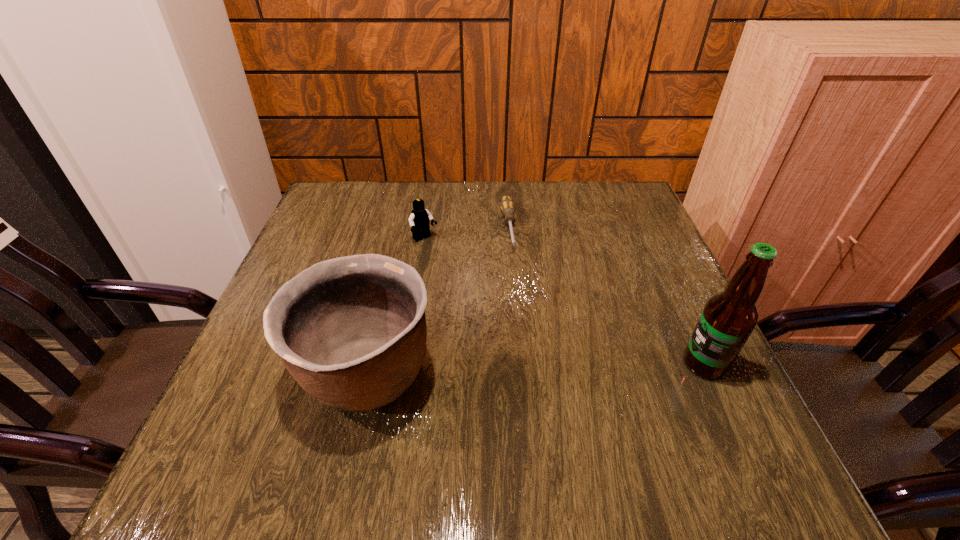
The height and width of the screenshot is (540, 960). Identify the location of free space located at the tip of the shortest object. (525, 345).

Where is `vacant space situated at the tip of the shortest object`? vacant space situated at the tip of the shortest object is located at coordinates (521, 322).

What are the coordinates of `free space located at the tip of the shortest object` in the screenshot? It's located at (527, 356).

In order to click on vacant space located on the front-facing side of the third tallest object in this screenshot , I will do `click(475, 294)`.

At what (x,y) coordinates should I click in order to perform the action: click on vacant space situated 0.210m on the front-facing side of the third tallest object. Please return your answer as a coordinate pair (x, y). Looking at the image, I should click on (475, 294).

The height and width of the screenshot is (540, 960). Find the location of `free location located on the front-facing side of the third tallest object`. free location located on the front-facing side of the third tallest object is located at coordinates (515, 338).

You are a GUI agent. You are given a task and a screenshot of the screen. Output one action in this format:
    pyautogui.click(x=<x>, y=<y>)
    Task: Click on the object located in the far edge section of the desktop
    The image size is (960, 540).
    Given the screenshot: What is the action you would take?
    pyautogui.click(x=507, y=205)

Where is `object located in the near edge section of the desktop`? The image size is (960, 540). object located in the near edge section of the desktop is located at coordinates (351, 330).

The height and width of the screenshot is (540, 960). Identify the location of object located in the left edge section of the desktop. (351, 330).

The width and height of the screenshot is (960, 540). I want to click on object that is at the right edge, so click(728, 318).